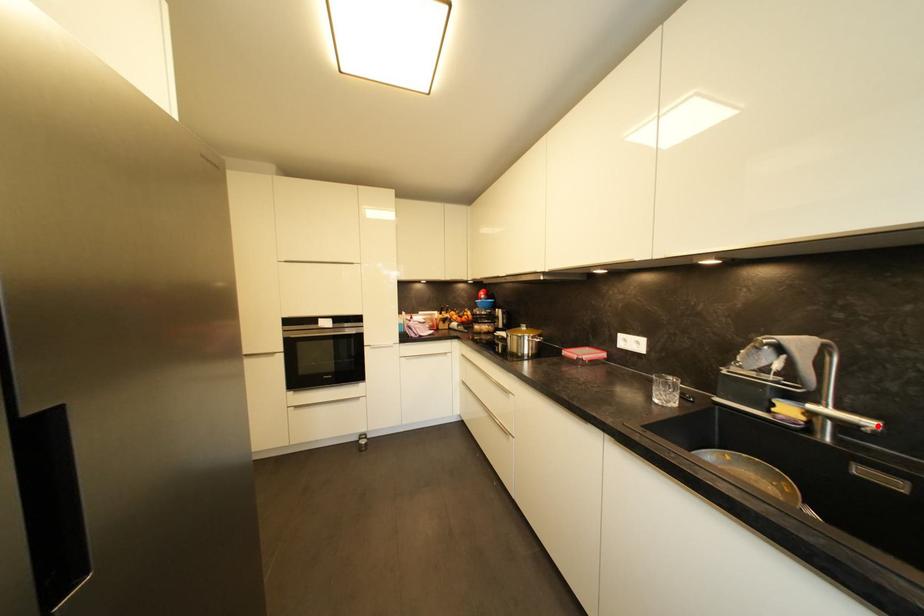
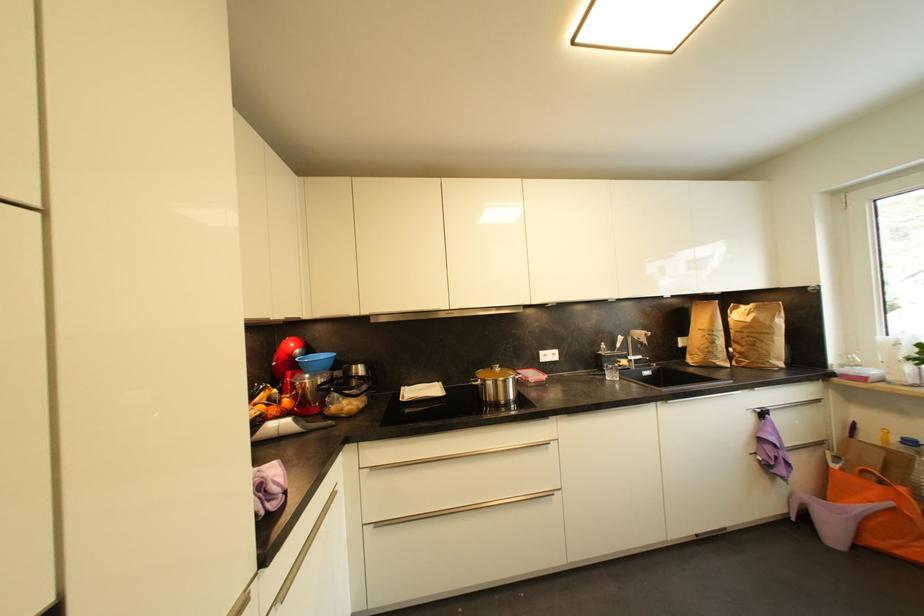
Question: I am providing you with two images of the same scene from different viewpoints. A red point is shown in image1. For the corresponding object point in image2, is it positioned nearer or farther from the camera?

Choices:
 (A) Nearer
 (B) Farther

Answer: (B)